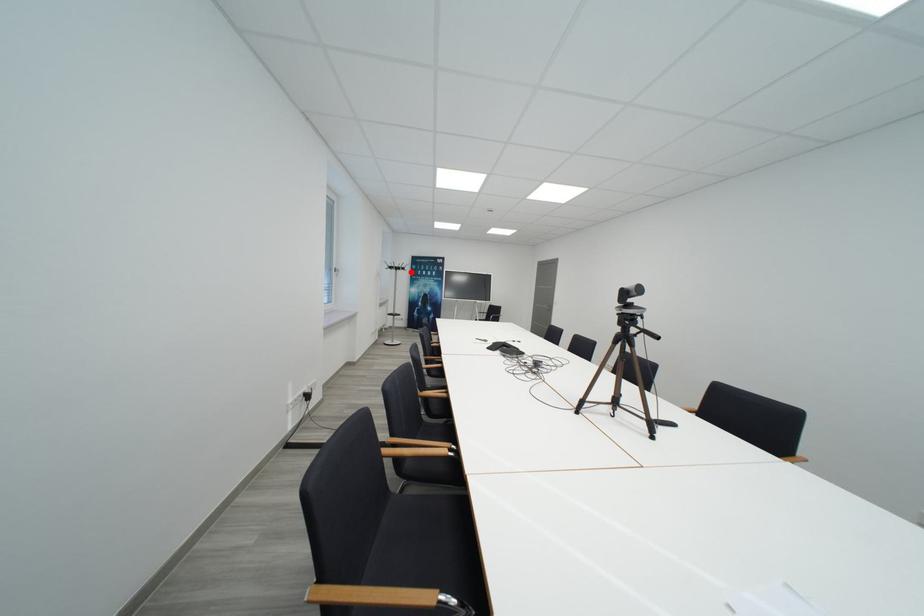
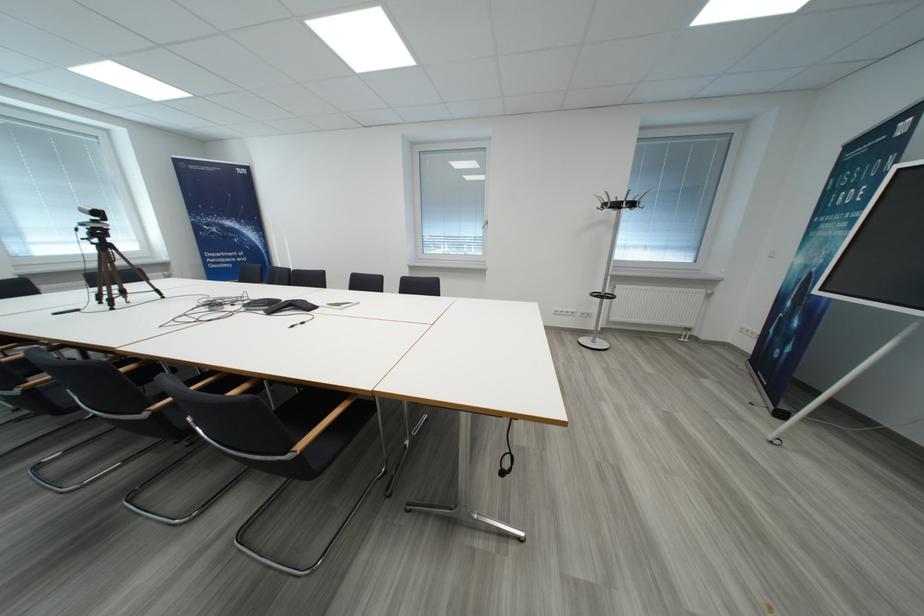
Locate, in the second image, the point that corresponds to the highlighted location in the first image.

(623, 208)